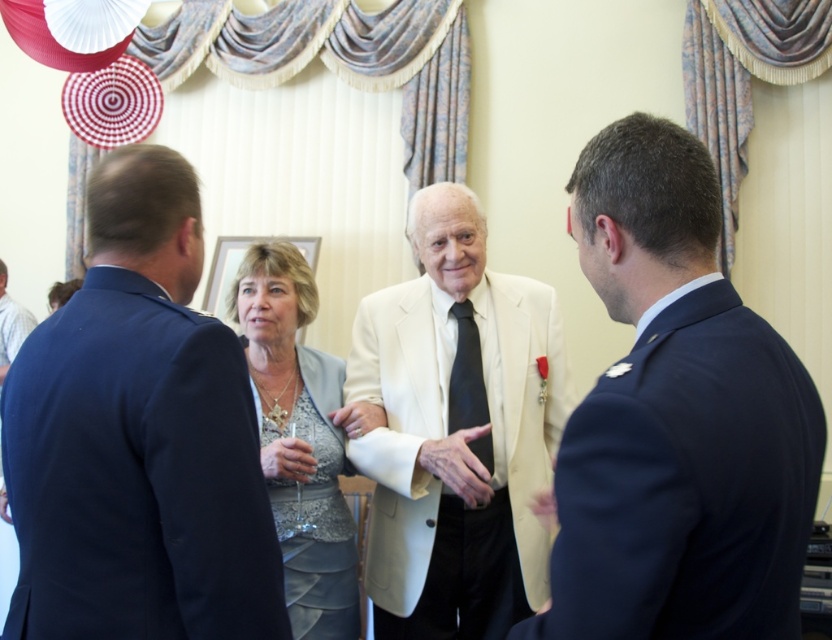
Question: Among these points, which one is nearest to the camera?

Choices:
 (A) (451, 380)
 (B) (498, 454)
 (C) (300, 440)

Answer: (C)

Question: Can you confirm if matte blue suit at right is positioned below dark blue suit at left?

Choices:
 (A) yes
 (B) no

Answer: (A)

Question: Based on their relative distances, which object is nearer to the matte blue suit at right?

Choices:
 (A) light beige suit at center
 (B) black silk tie at center
 (C) dark blue suit at left
 (D) blue fabric suit at center

Answer: (D)

Question: In this image, where is light beige suit at center located relative to black silk tie at center?

Choices:
 (A) right
 (B) left

Answer: (B)

Question: Is black silk tie at center thinner than dark blue suit at left?

Choices:
 (A) no
 (B) yes

Answer: (B)

Question: Which of these objects is positioned farthest from the black silk tie at center?

Choices:
 (A) light beige suit at center
 (B) blue fabric suit at center

Answer: (B)